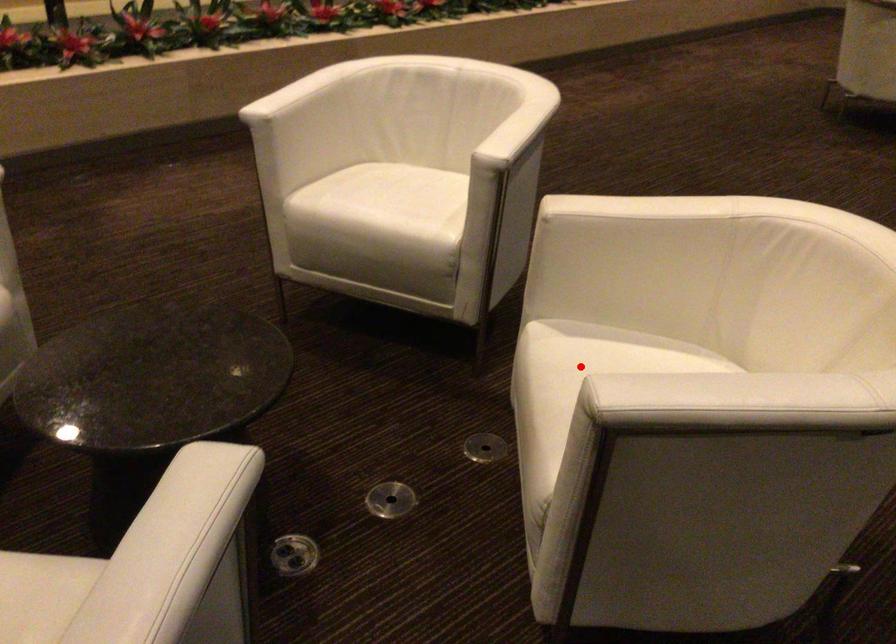
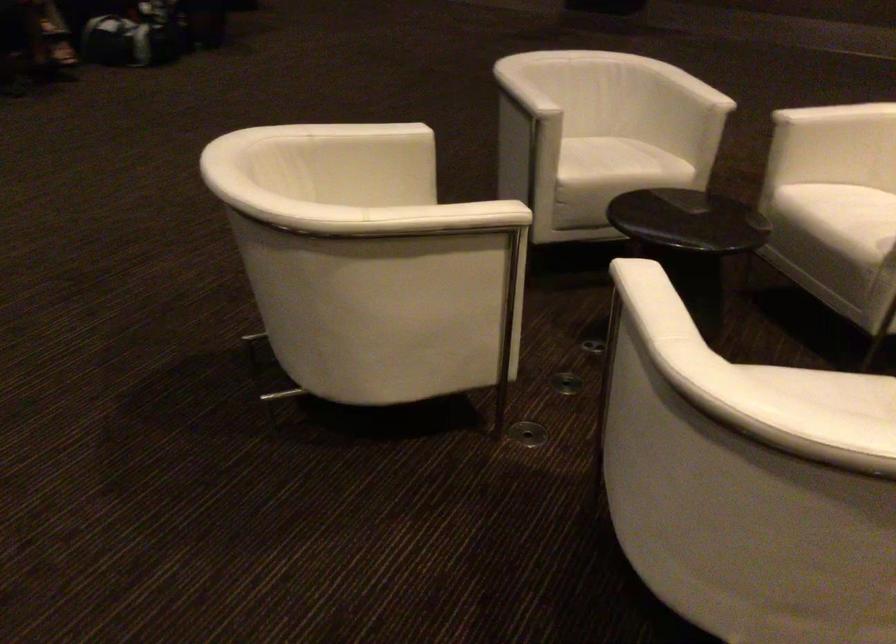
Question: I am providing you with two images of the same scene from different viewpoints. A red point is marked on the first image. Is the red point's position out of view in image 2?

Choices:
 (A) Yes
 (B) No

Answer: (A)